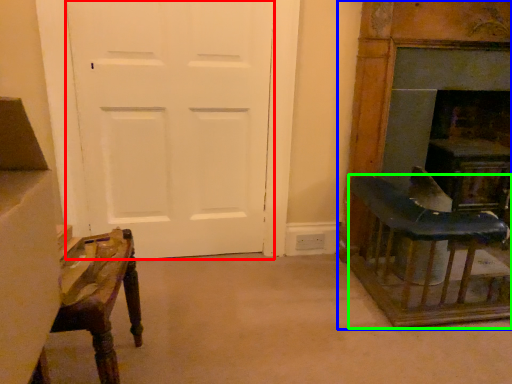
Question: Which object is positioned closest to screen door (highlighted by a red box)? Select from furniture (highlighted by a blue box) and table (highlighted by a green box).

Choices:
 (A) furniture
 (B) table

Answer: (A)